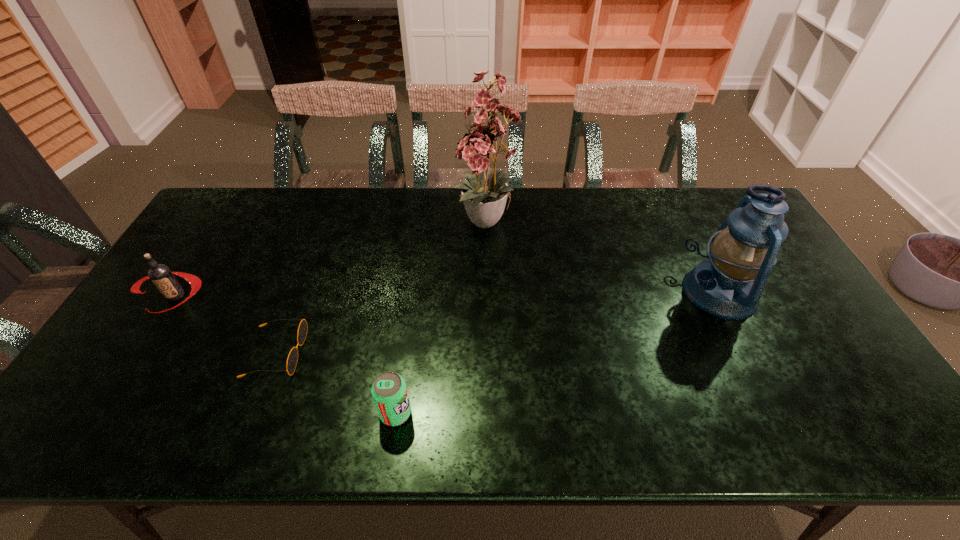
This screenshot has height=540, width=960. I want to click on vacant region located 0.130m on the front-facing side of the second object from right to left, so click(x=489, y=290).

The image size is (960, 540). Find the location of `vacant space located on the face of the rightmost object`. vacant space located on the face of the rightmost object is located at coordinates (553, 292).

What are the coordinates of `free location located 0.340m on the face of the rightmost object` in the screenshot? It's located at (566, 292).

Find the location of `free spot located 0.210m on the face of the rightmost object`. free spot located 0.210m on the face of the rightmost object is located at coordinates (612, 292).

Find the location of a particular element. vacant area situated on the label of the third shortest object is located at coordinates (138, 355).

The width and height of the screenshot is (960, 540). In order to click on free space located 0.070m on the front-facing side of the second shortest object in this screenshot , I will do coord(442,413).

Identify the location of free spot located 0.220m on the front-facing side of the shortest object. Image resolution: width=960 pixels, height=540 pixels. (389, 353).

Where is `object located at the far edge`? Image resolution: width=960 pixels, height=540 pixels. object located at the far edge is located at coordinates (484, 196).

Where is `object present at the near edge`? The image size is (960, 540). object present at the near edge is located at coordinates (389, 391).

This screenshot has height=540, width=960. In order to click on object that is at the left edge in this screenshot , I will do `click(162, 277)`.